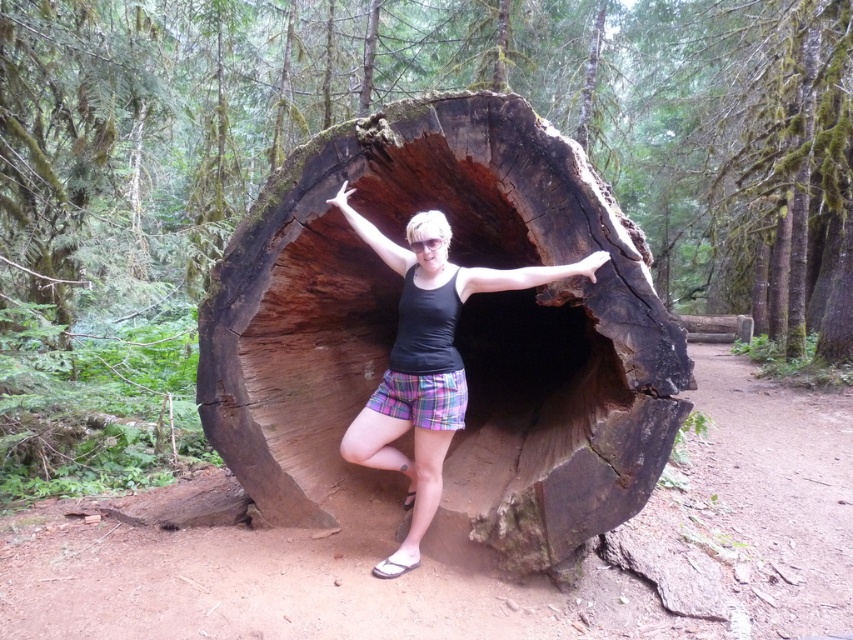
You are a hiker who wants to climb onto the dark brown wood log at center while wearing the plaid shorts at center. Considering the height difference between them, do you think you can step onto the log without needing a ladder?

The dark brown wood log at center is much taller than plaid shorts at center, so you might need a ladder or some assistance to reach its top since the height difference is significant.

You are a photographer trying to capture a person standing inside a large hollowed tree trunk. You notice the dark brown wood log at center and the plaid shorts at center. Which object is positioned higher in the image?

The dark brown wood log at center is positioned higher than the plaid shorts at center.